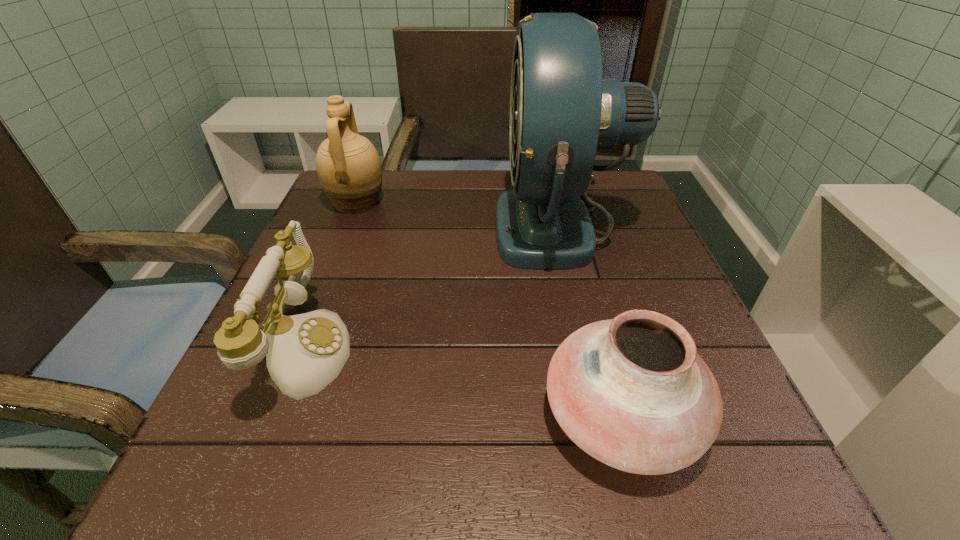
Where is `blank area in the image that satisfies the following two spatial constraints: 1. on the dial of the telephone; 2. on the right side of the pottery`? blank area in the image that satisfies the following two spatial constraints: 1. on the dial of the telephone; 2. on the right side of the pottery is located at coordinates (278, 417).

Where is `free space that satisfies the following two spatial constraints: 1. on the back side of the pottery; 2. in front of the fan to blow air`? The image size is (960, 540). free space that satisfies the following two spatial constraints: 1. on the back side of the pottery; 2. in front of the fan to blow air is located at coordinates (569, 225).

Locate an element on the screen. This screenshot has width=960, height=540. free space that satisfies the following two spatial constraints: 1. in front of the pottery to blow air; 2. on the left side of the tallest object is located at coordinates (608, 417).

This screenshot has height=540, width=960. In order to click on free region that satisfies the following two spatial constraints: 1. in front of the pottery to blow air; 2. on the right side of the fan in this screenshot , I will do `click(608, 417)`.